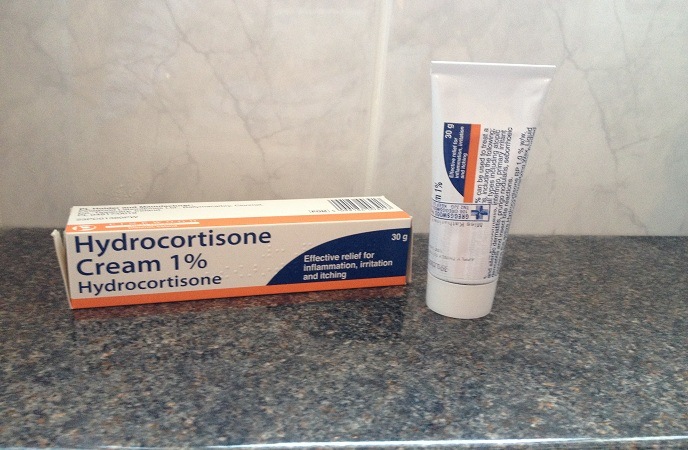
Image resolution: width=688 pixels, height=450 pixels. I want to click on backsplash, so click(x=294, y=55).